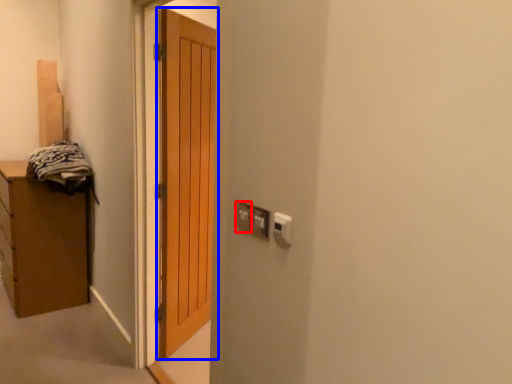
Question: Which point is further to the camera, electric outlet (highlighted by a red box) or door (highlighted by a blue box)?

Choices:
 (A) electric outlet
 (B) door

Answer: (B)